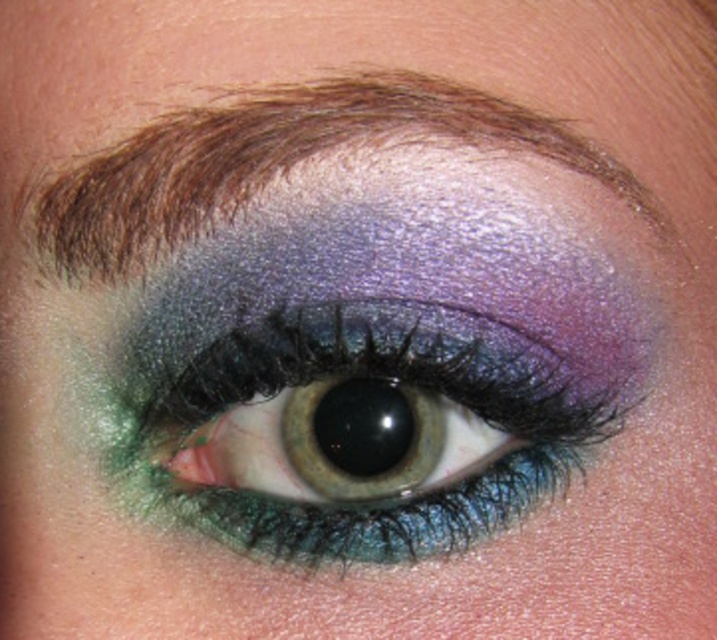
Question: Which of the following is the farthest from the observer?

Choices:
 (A) (128, 381)
 (B) (62, 257)

Answer: (A)

Question: Is shimmering metallic eye at center below shiny brown eyebrow at upper center?

Choices:
 (A) yes
 (B) no

Answer: (A)

Question: Considering the relative positions of shimmering metallic eye at center and shiny brown eyebrow at upper center in the image provided, where is shimmering metallic eye at center located with respect to shiny brown eyebrow at upper center?

Choices:
 (A) left
 (B) right

Answer: (B)

Question: Among these objects, which one is farthest from the camera?

Choices:
 (A) shiny brown eyebrow at upper center
 (B) shimmering metallic eye at center

Answer: (B)

Question: Is shimmering metallic eye at center thinner than shiny brown eyebrow at upper center?

Choices:
 (A) no
 (B) yes

Answer: (B)